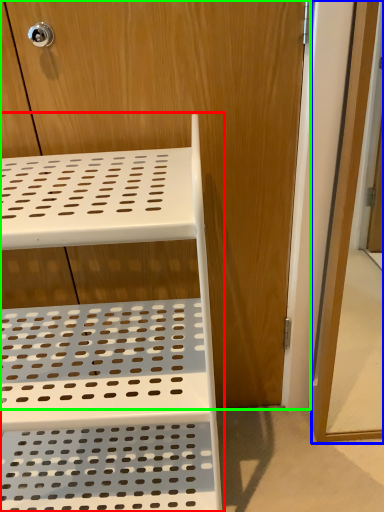
Question: Estimate the real-world distances between objects in this image. Which object is closer to furniture (highlighted by a red box), screen door (highlighted by a blue box) or dresser (highlighted by a green box)?

Choices:
 (A) screen door
 (B) dresser

Answer: (B)